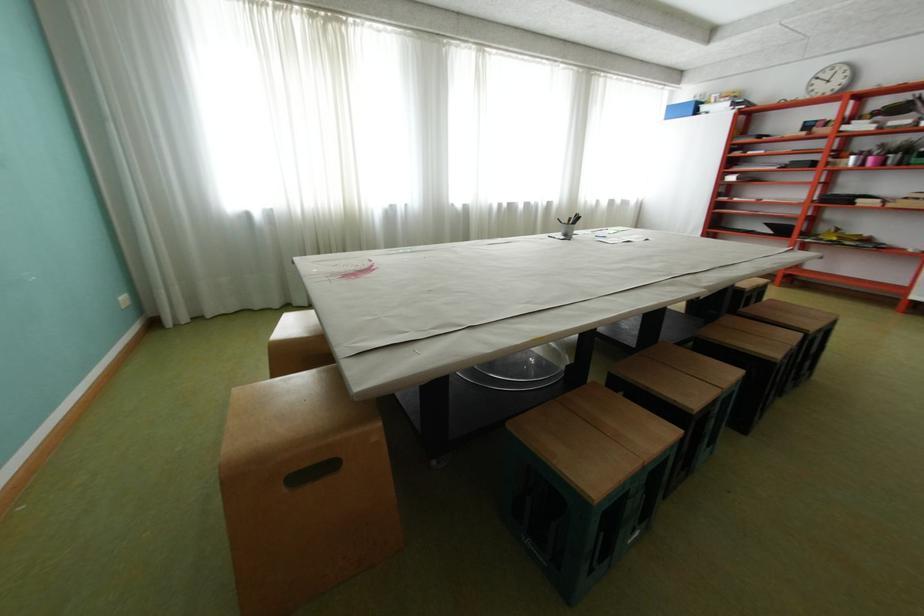
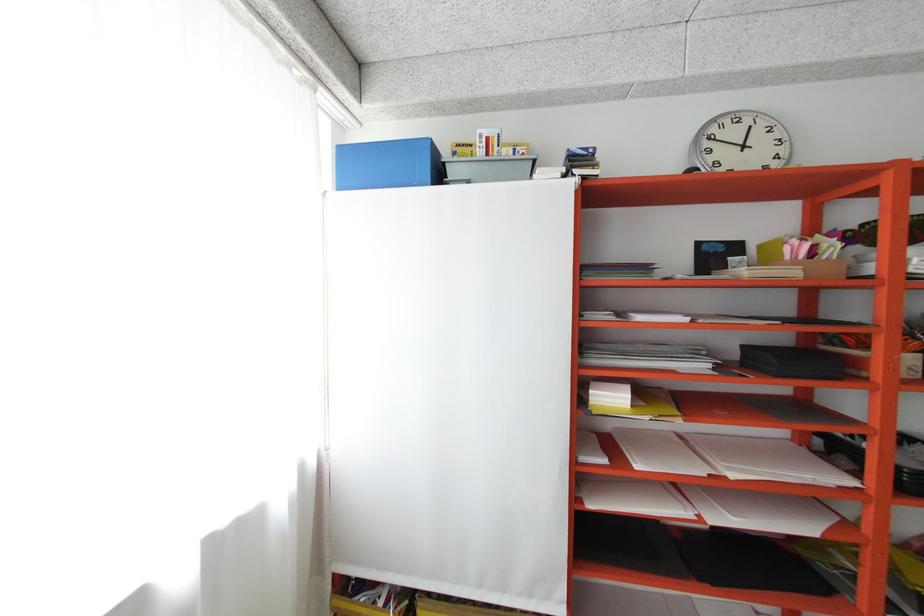
Where in the second image is the point corresponding to (x=821, y=89) from the first image?

(720, 159)